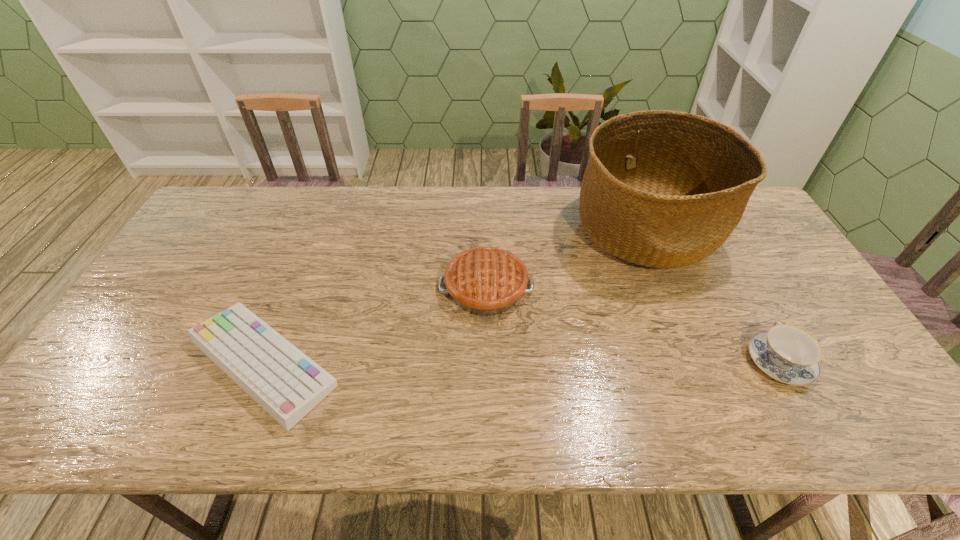
Image resolution: width=960 pixels, height=540 pixels. I want to click on the tallest object, so click(665, 189).

Image resolution: width=960 pixels, height=540 pixels. I want to click on the second object from left to right, so click(485, 281).

The width and height of the screenshot is (960, 540). Identify the location of the second tallest object. 485,281.

Image resolution: width=960 pixels, height=540 pixels. I want to click on chinaware, so click(788, 354).

What are the coordinates of `the leftmost object` in the screenshot? It's located at 286,383.

Image resolution: width=960 pixels, height=540 pixels. Find the location of `the shortest object`. the shortest object is located at coordinates (286, 383).

In order to click on free region located 0.370m on the left of the basket in this screenshot , I will do `click(460, 229)`.

Locate an element on the screen. The image size is (960, 540). free point located 0.400m on the right of the pie is located at coordinates (675, 288).

Image resolution: width=960 pixels, height=540 pixels. What are the coordinates of `vacant area situated 0.170m with the handle on the side of the chinaware` in the screenshot? It's located at (737, 286).

At what (x,y) coordinates should I click in order to perform the action: click on free space located 0.350m with the handle on the side of the chinaware. Please return your answer as a coordinate pair (x, y). The image size is (960, 540). Looking at the image, I should click on (714, 244).